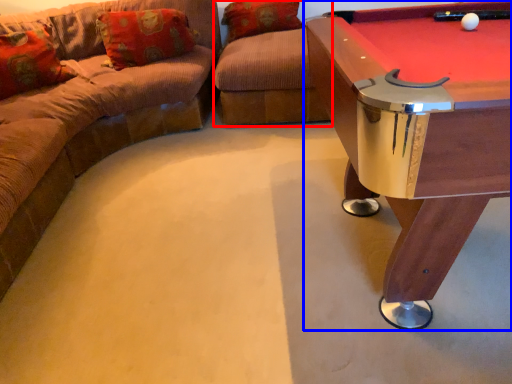
Question: Which object appears closest to the camera in this image, swivel chair (highlighted by a red box) or table (highlighted by a blue box)?

Choices:
 (A) swivel chair
 (B) table

Answer: (B)